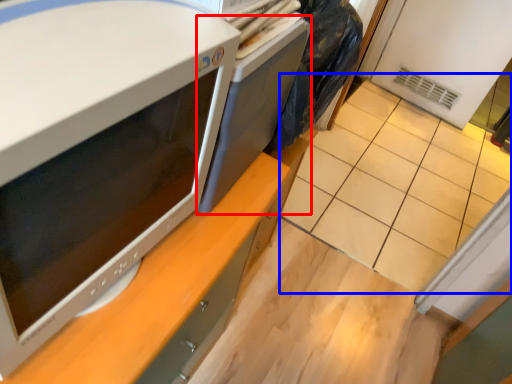
Question: Among these objects, which one is nearest to the camera, desktop (highlighted by a red box) or tile (highlighted by a blue box)?

Choices:
 (A) desktop
 (B) tile

Answer: (A)